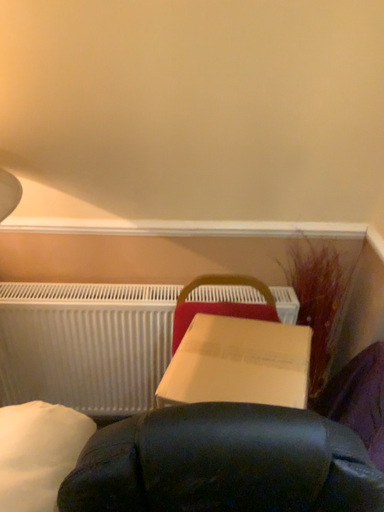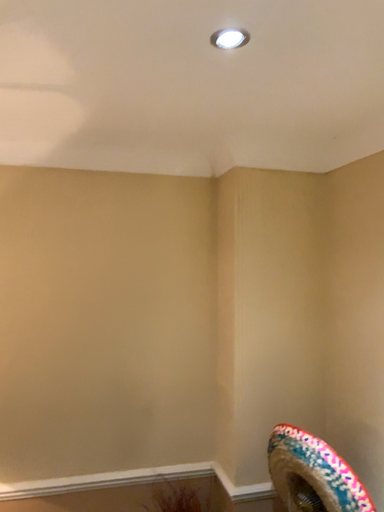
Question: Which way did the camera rotate in the video?

Choices:
 (A) rotated left
 (B) rotated right

Answer: (B)